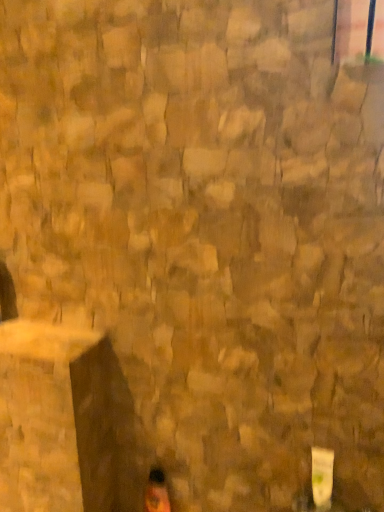
What do you see at coordinates (322, 477) in the screenshot?
I see `white plastic window at lower right` at bounding box center [322, 477].

The width and height of the screenshot is (384, 512). What are the coordinates of `white plastic window at lower right` in the screenshot? It's located at (322, 477).

Locate an element on the screen. This screenshot has height=512, width=384. white plastic window at lower right is located at coordinates (322, 477).